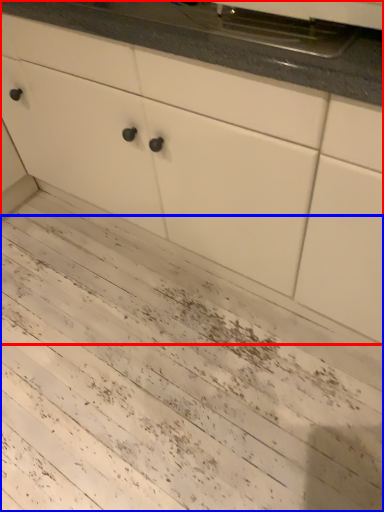
Question: Which point is further to the camera, cabinetry (highlighted by a red box) or mud (highlighted by a blue box)?

Choices:
 (A) cabinetry
 (B) mud

Answer: (B)